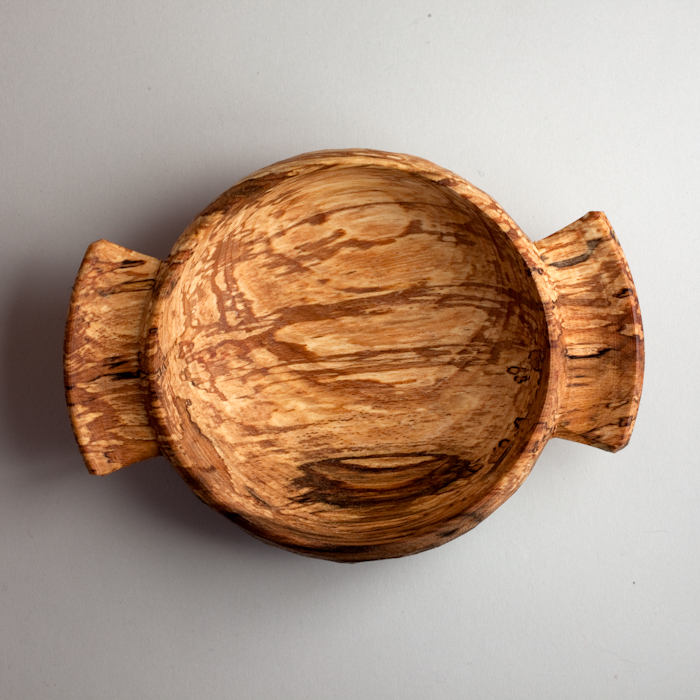
Find the location of a particular element. handle is located at coordinates (132, 368).